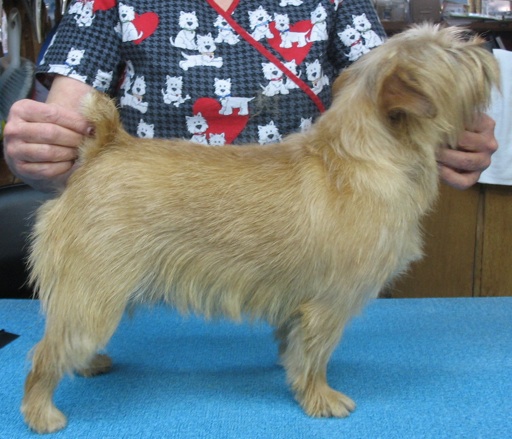
Identify the location of blue mat. The height and width of the screenshot is (439, 512). (234, 372), (490, 373), (260, 393).